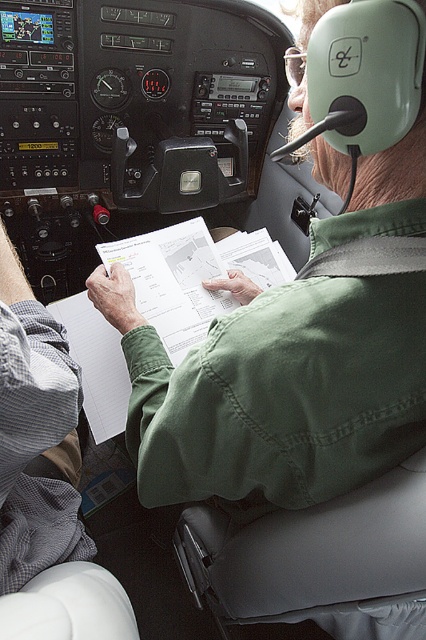
Does point (224, 328) come farther from viewer compared to point (112, 381)?

No.

Is green cotton shirt at center positioned behind white paper at center?

No, green cotton shirt at center is closer to the viewer.

Which is behind, point (241, 365) or point (183, 268)?

The point (183, 268) is more distant.

The height and width of the screenshot is (640, 426). What are the coordinates of `green cotton shirt at center` in the screenshot? It's located at (275, 390).